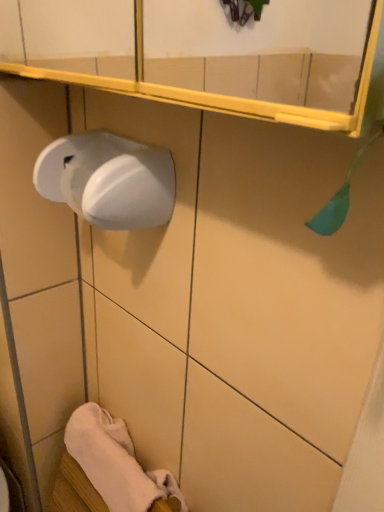
Question: From the image's perspective, is white glossy soap dispenser at left above white soft towel at lower left?

Choices:
 (A) yes
 (B) no

Answer: (A)

Question: Is white glossy soap dispenser at left beside white soft towel at lower left?

Choices:
 (A) yes
 (B) no

Answer: (B)

Question: Does white glossy soap dispenser at left appear on the right side of white soft towel at lower left?

Choices:
 (A) no
 (B) yes

Answer: (B)

Question: From a real-world perspective, is white glossy soap dispenser at left positioned under white soft towel at lower left based on gravity?

Choices:
 (A) yes
 (B) no

Answer: (B)

Question: Is white glossy soap dispenser at left positioned before white soft towel at lower left?

Choices:
 (A) no
 (B) yes

Answer: (B)

Question: Considering the relative positions of white glossy paper towel at left and white glossy soap dispenser at left in the image provided, is white glossy paper towel at left to the left or to the right of white glossy soap dispenser at left?

Choices:
 (A) right
 (B) left

Answer: (B)

Question: From the image's perspective, relative to white glossy soap dispenser at left, is white glossy paper towel at left above or below?

Choices:
 (A) below
 (B) above

Answer: (B)

Question: Considering the positions of point (46, 181) and point (301, 160), is point (46, 181) closer or farther from the camera than point (301, 160)?

Choices:
 (A) farther
 (B) closer

Answer: (A)

Question: Choose the correct answer: Is white glossy paper towel at left inside white glossy soap dispenser at left or outside it?

Choices:
 (A) inside
 (B) outside

Answer: (B)

Question: Is white glossy soap dispenser at left wider or thinner than white soft towel at lower left?

Choices:
 (A) thin
 (B) wide

Answer: (A)

Question: From the image's perspective, relative to white soft towel at lower left, is white glossy soap dispenser at left above or below?

Choices:
 (A) below
 (B) above

Answer: (B)

Question: Which is correct: white glossy soap dispenser at left is inside white soft towel at lower left, or outside of it?

Choices:
 (A) inside
 (B) outside

Answer: (B)

Question: In the image, is white glossy soap dispenser at left on the left side or the right side of white soft towel at lower left?

Choices:
 (A) left
 (B) right

Answer: (B)

Question: Visually, is white glossy paper towel at left positioned to the left or to the right of white soft towel at lower left?

Choices:
 (A) right
 (B) left

Answer: (A)

Question: Is point (79, 139) positioned closer to the camera than point (87, 421)?

Choices:
 (A) closer
 (B) farther

Answer: (A)